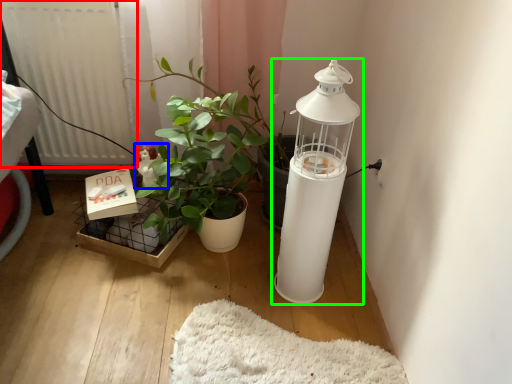
Question: Based on their relative distances, which object is farther from radiator (highlighted by a red box)? Choose from toy (highlighted by a blue box) and lamp (highlighted by a green box).

Choices:
 (A) toy
 (B) lamp

Answer: (B)